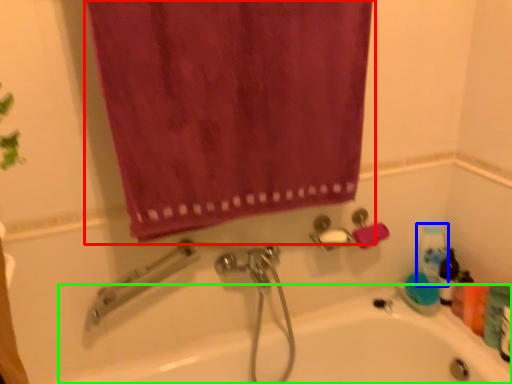
Question: Which object is positioned farthest from curtain (highlighted by a red box)? Select from cleaning product (highlighted by a blue box) and bath (highlighted by a green box).

Choices:
 (A) cleaning product
 (B) bath

Answer: (A)